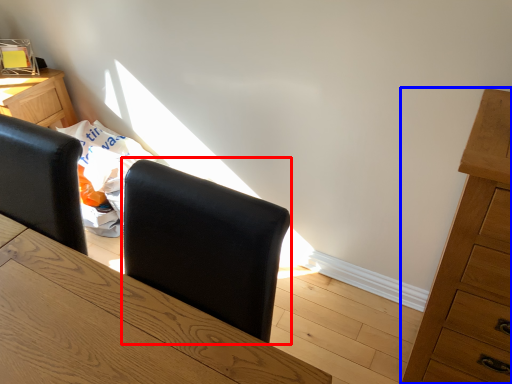
Question: Among these objects, which one is nearest to the camera, armchair (highlighted by a red box) or chest of drawers (highlighted by a blue box)?

Choices:
 (A) armchair
 (B) chest of drawers

Answer: (A)